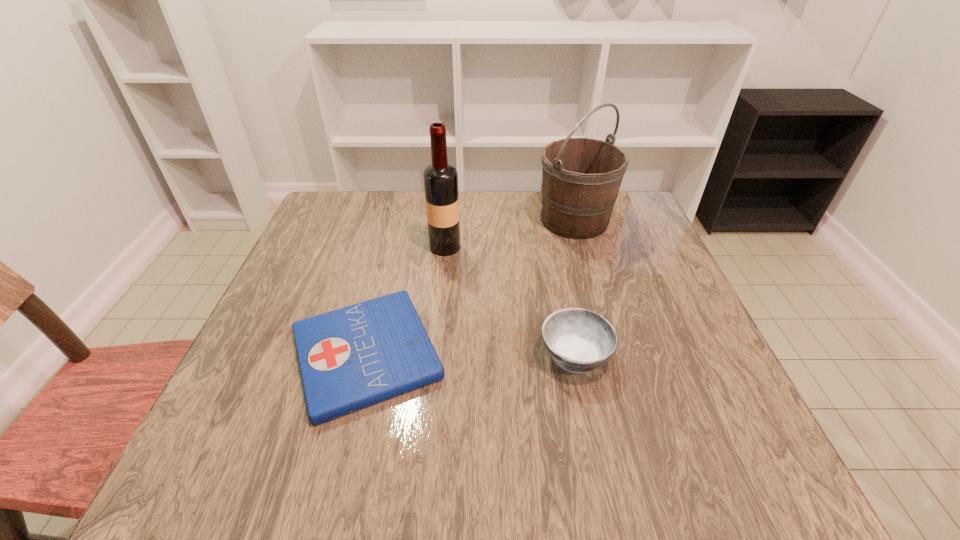
The height and width of the screenshot is (540, 960). Identify the location of blank region between the bucket and the second shortest object. (575, 288).

Where is `empty space between the second shortest object and the wine bottle`? The width and height of the screenshot is (960, 540). empty space between the second shortest object and the wine bottle is located at coordinates (510, 301).

Find the location of a particular element. Image resolution: width=960 pixels, height=540 pixels. vacant space in between the shortest object and the bucket is located at coordinates (470, 287).

I want to click on free space between the bucket and the shortest object, so click(x=470, y=287).

Where is `the closest object to the second shortest object`? Image resolution: width=960 pixels, height=540 pixels. the closest object to the second shortest object is located at coordinates (350, 358).

Point out which object is positioned as the nearest to the wine bottle. Please provide its 2D coordinates. Your answer should be formatted as a tuple, i.e. [(x, y)], where the tuple contains the x and y coordinates of a point satisfying the conditions above.

[(350, 358)]

What are the coordinates of `vacant space that satisfies the following two spatial constraints: 1. on the back side of the wine bottle; 2. on the right side of the bucket` in the screenshot? It's located at (447, 220).

I want to click on free spot that satisfies the following two spatial constraints: 1. on the front side of the wine bottle; 2. on the right side of the ashtray, so [x=434, y=355].

At what (x,y) coordinates should I click in order to perform the action: click on free spot that satisfies the following two spatial constraints: 1. on the front side of the wine bottle; 2. on the right side of the ashtray. Please return your answer as a coordinate pair (x, y). Image resolution: width=960 pixels, height=540 pixels. Looking at the image, I should click on (434, 355).

Locate an element on the screen. The image size is (960, 540). vacant area in the image that satisfies the following two spatial constraints: 1. on the back side of the bucket; 2. on the right side of the shortest object is located at coordinates (399, 220).